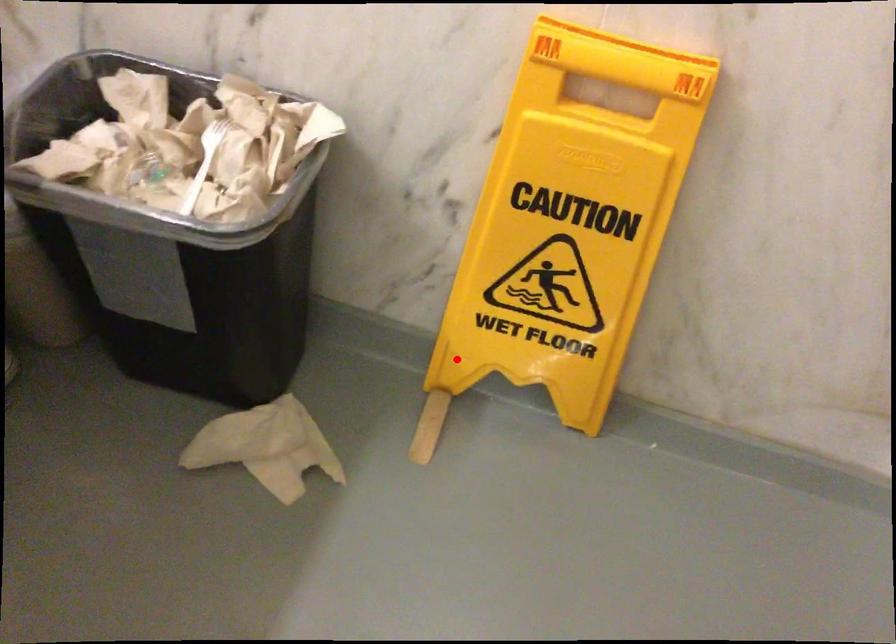
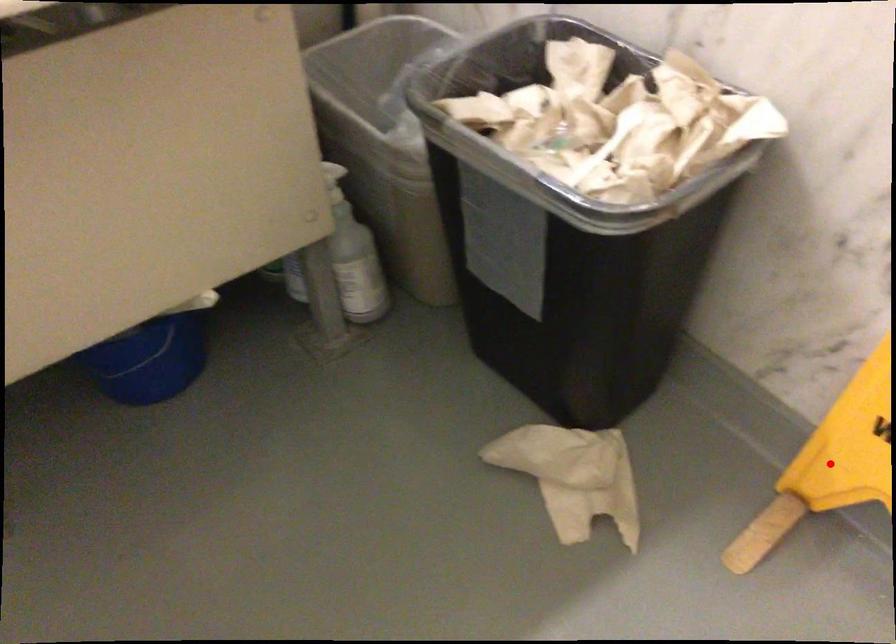
I am providing you with two images of the same scene from different viewpoints. A red point is marked on the first image and another point is marked on the second image. Are the points marked in image1 and image2 representing the same 3D position?

Yes